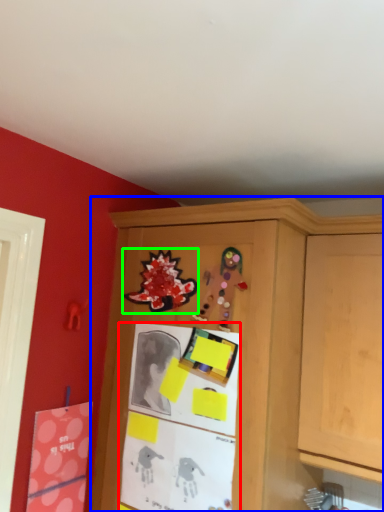
Question: Which object is positioned farthest from bulletin board (highlighted by a red box)? Select from cabinetry (highlighted by a blue box) and art (highlighted by a green box).

Choices:
 (A) cabinetry
 (B) art

Answer: (B)